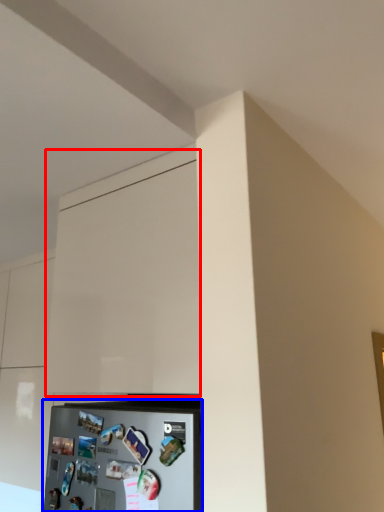
Question: Which point is further to the camera, cabinetry (highlighted by a red box) or appliance (highlighted by a blue box)?

Choices:
 (A) cabinetry
 (B) appliance

Answer: (A)